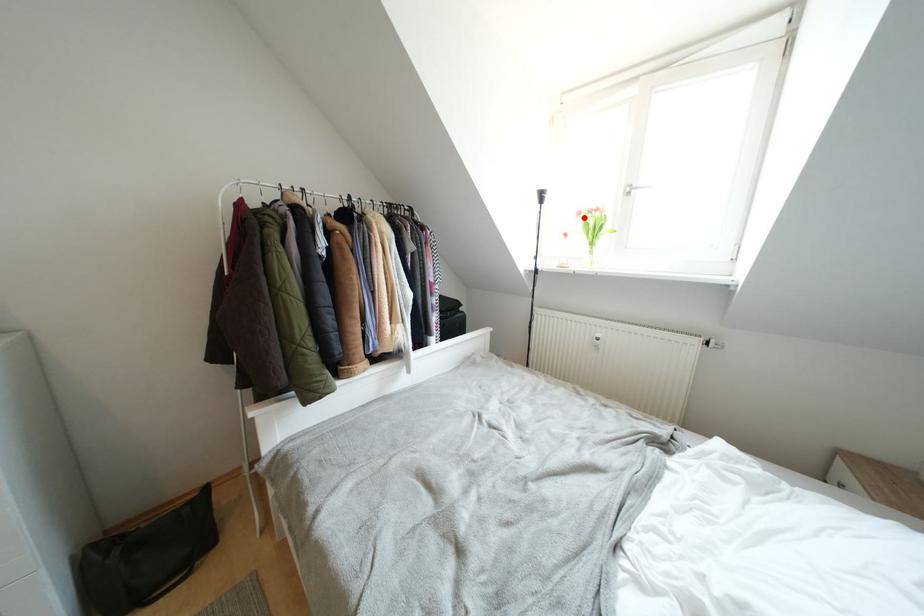
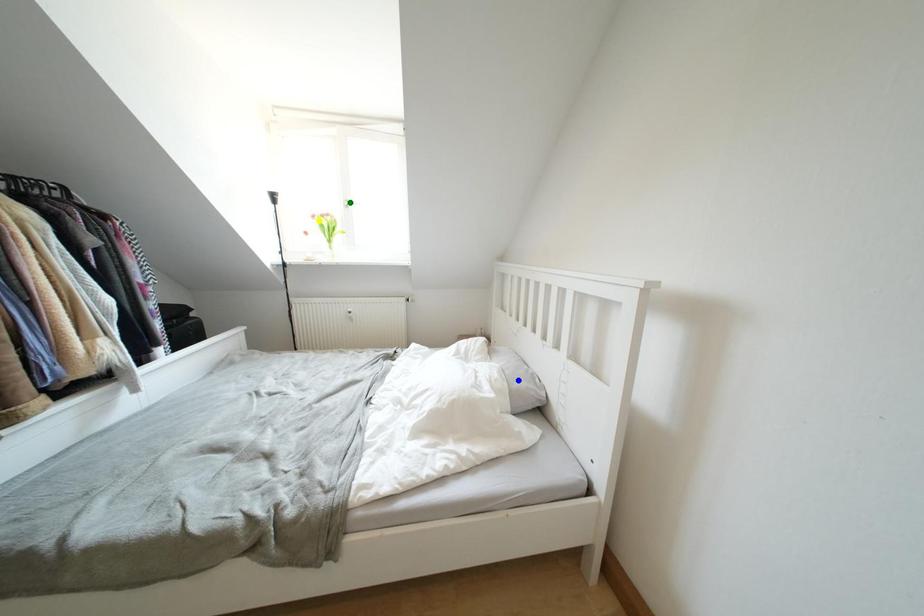
Question: I am providing you with two images of the same scene from different viewpoints. A red point is marked on the first image. You are given multiple points on the second image. Which point in image 2 represents the same 3d spot as the red point in image 1?

Choices:
 (A) blue point
 (B) yellow point
 (C) green point

Answer: (B)